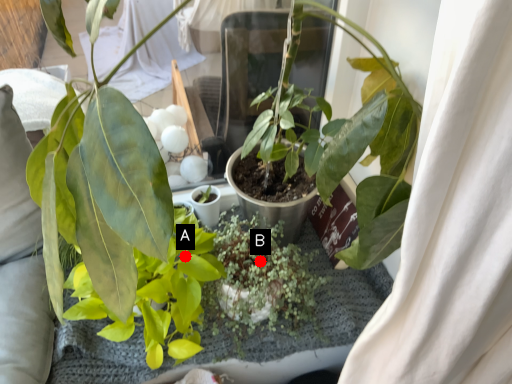
Question: Two points are circled on the image, labeled by A and B beside each circle. Which point is closer to the camera?

Choices:
 (A) A is closer
 (B) B is closer

Answer: (A)